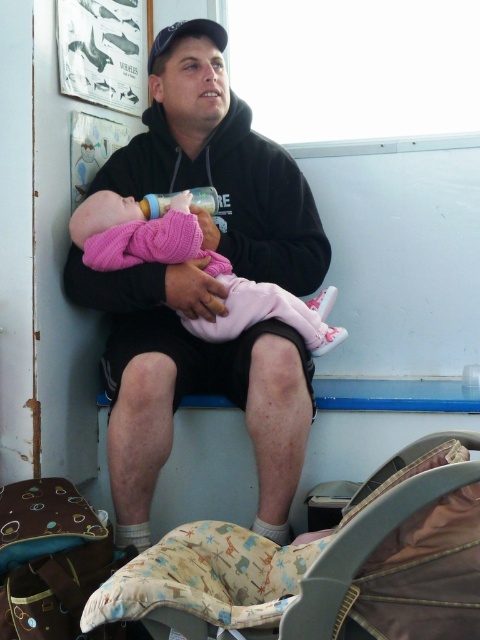
Is black hoodie at center shorter than pink knitted baby at center?

No, black hoodie at center is not shorter than pink knitted baby at center.

Does black hoodie at center have a larger size compared to pink knitted baby at center?

Correct, black hoodie at center is larger in size than pink knitted baby at center.

Measure the distance between point (177,333) and camera.

A distance of 6.15 feet exists between point (177,333) and camera.

Find the location of `black hoodie at center`. black hoodie at center is located at coordinates (206, 285).

Can you confirm if patterned fabric car seat at lower center is positioned to the left of pink knitted baby at center?

Incorrect, patterned fabric car seat at lower center is not on the left side of pink knitted baby at center.

Between point (212, 621) and point (226, 333), which one is positioned behind?

The point (226, 333) is behind.

Does point (173, 572) come closer to viewer compared to point (96, 259)?

Yes, it is.

The width and height of the screenshot is (480, 640). Find the location of `patterned fabric car seat at lower center`. patterned fabric car seat at lower center is located at coordinates (230, 564).

Between point (140, 333) and point (372, 620), which one is positioned behind?

The point (140, 333) is behind.

Who is more distant from viewer, (261, 371) or (422, 465)?

The point (261, 371) is behind.

Locate an element on the screen. Image resolution: width=480 pixels, height=640 pixels. black hoodie at center is located at coordinates (206, 285).